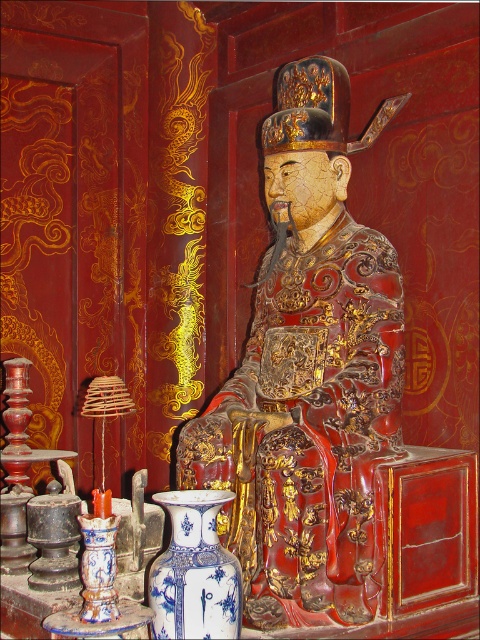
Question: Which object is closer to the camera taking this photo?

Choices:
 (A) blue porcelain vase at center
 (B) glossy wood statue at center

Answer: (A)

Question: Is glossy wood statue at center to the left of blue porcelain vase at center from the viewer's perspective?

Choices:
 (A) no
 (B) yes

Answer: (A)

Question: Does glossy wood statue at center appear on the left side of blue porcelain vase at center?

Choices:
 (A) yes
 (B) no

Answer: (B)

Question: In this image, where is glossy wood statue at center located relative to blue porcelain vase at center?

Choices:
 (A) left
 (B) right

Answer: (B)

Question: Which of the following is the farthest from the observer?

Choices:
 (A) [x=216, y=568]
 (B) [x=261, y=528]

Answer: (B)